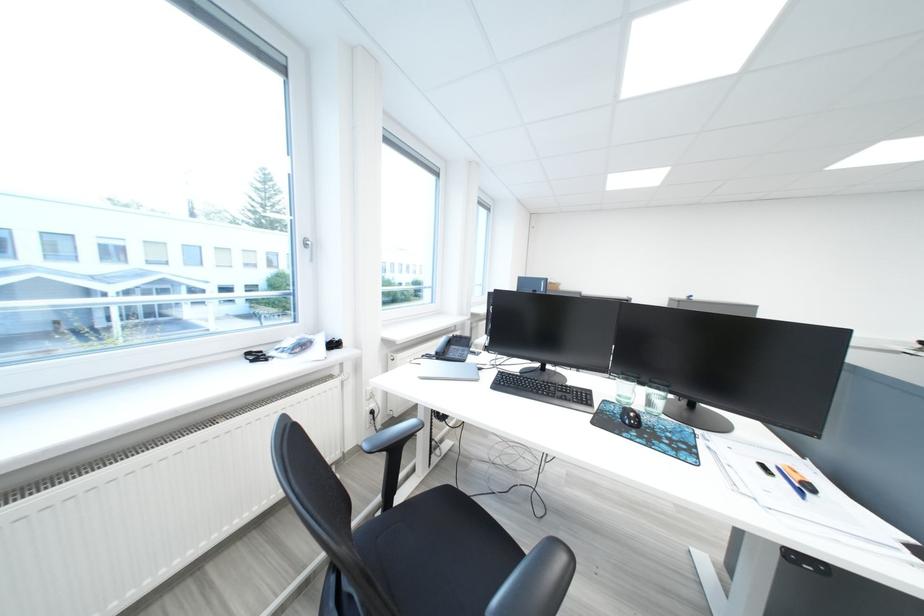
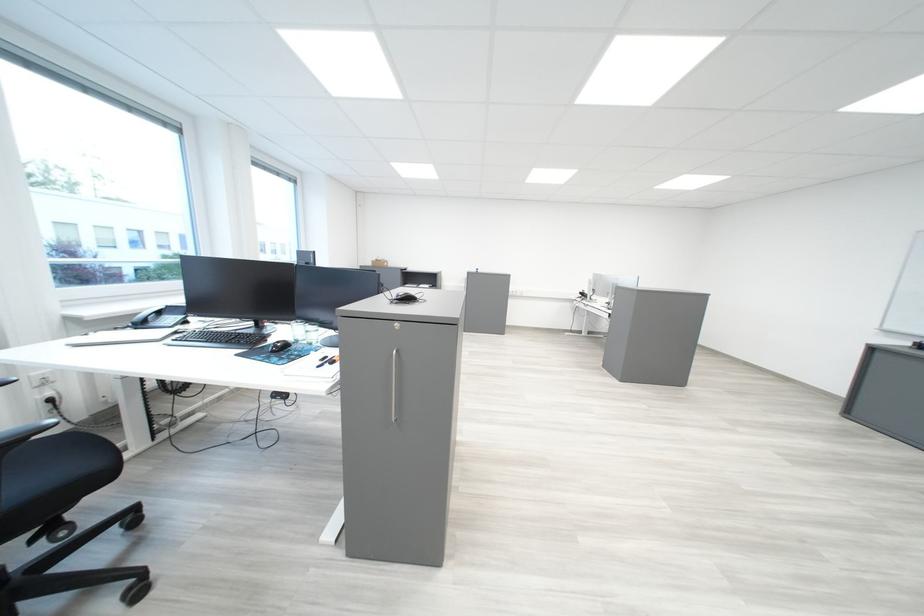
The images are taken continuously from a first-person perspective. In which direction are you moving?

The movement direction of the cameraman is right, backward.